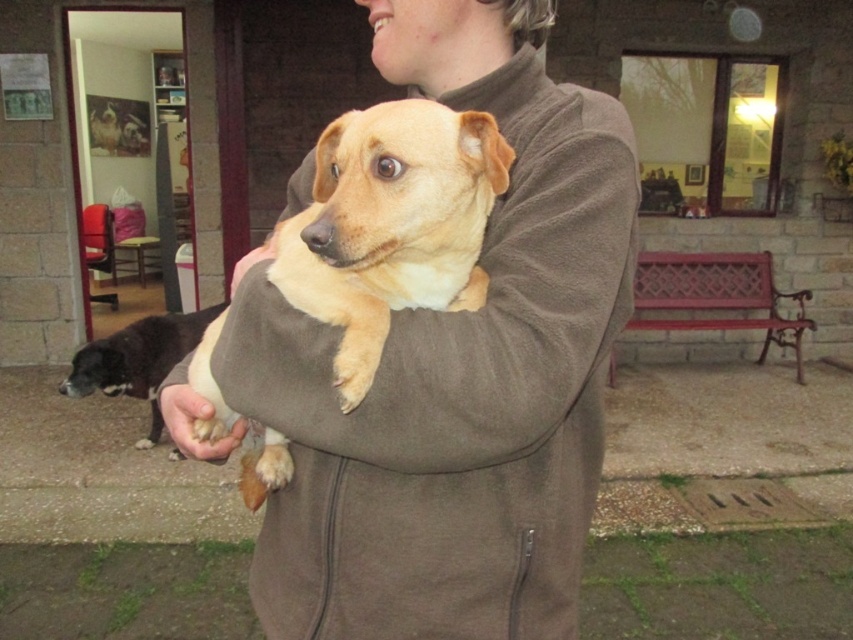
Question: Among these objects, which one is farthest from the camera?

Choices:
 (A) brown fleece jacket at center
 (B) light brown fur at center
 (C) fuzzy beige dog at center
 (D) fur at center

Answer: (C)

Question: Can you confirm if brown fleece jacket at center is positioned to the left of black and white fur at lower left?

Choices:
 (A) yes
 (B) no

Answer: (B)

Question: Which object appears farthest from the camera in this image?

Choices:
 (A) light brown fur at center
 (B) fur at center
 (C) brown fleece jacket at center
 (D) black and white fur at lower left

Answer: (D)

Question: Is light brown fur at center smaller than black and white fur at lower left?

Choices:
 (A) yes
 (B) no

Answer: (A)

Question: Is light brown fur at center smaller than fur at center?

Choices:
 (A) no
 (B) yes

Answer: (A)

Question: Considering the real-world distances, which object is closest to the fuzzy beige dog at center?

Choices:
 (A) fur at center
 (B) black and white fur at lower left
 (C) light brown fur at center

Answer: (C)